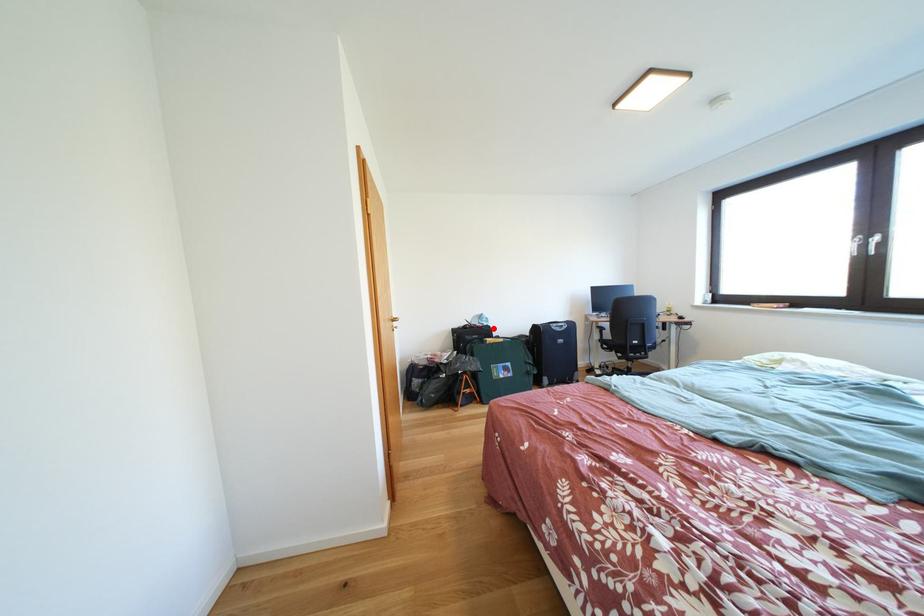
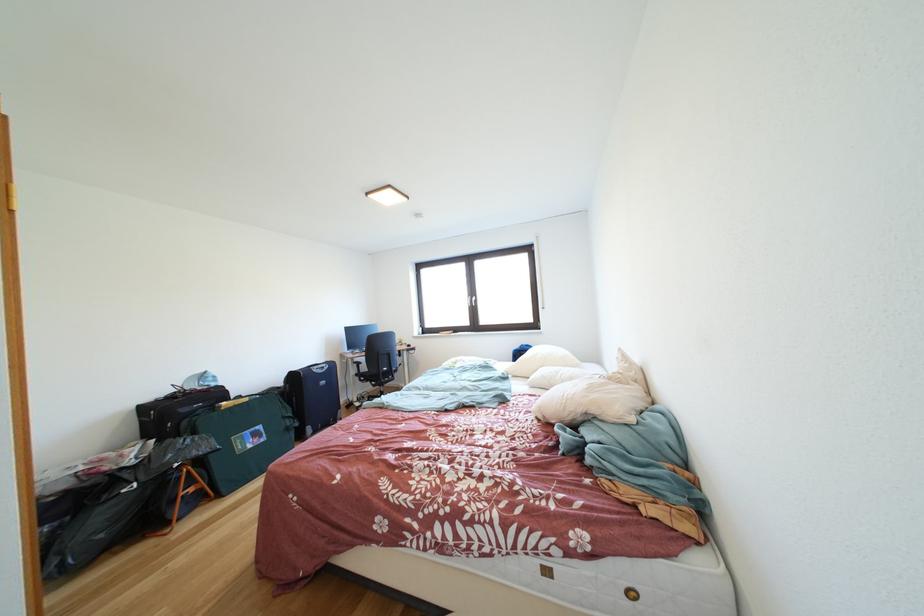
Question: I am providing you with two images of the same scene from different viewpoints. A red point is marked on the first image. At the location where the point appears in image 1, is it still visible in image 2?

Choices:
 (A) Yes
 (B) No

Answer: (A)